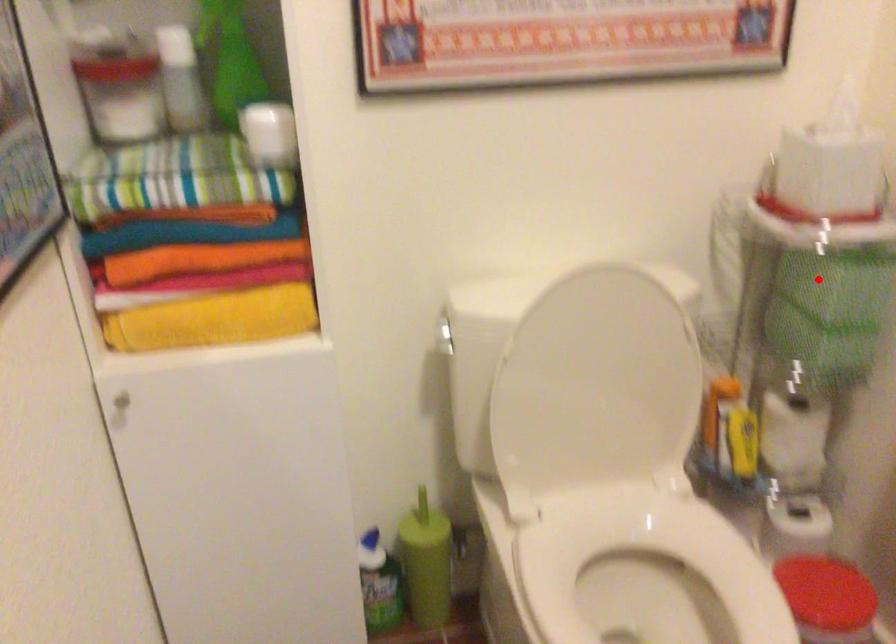
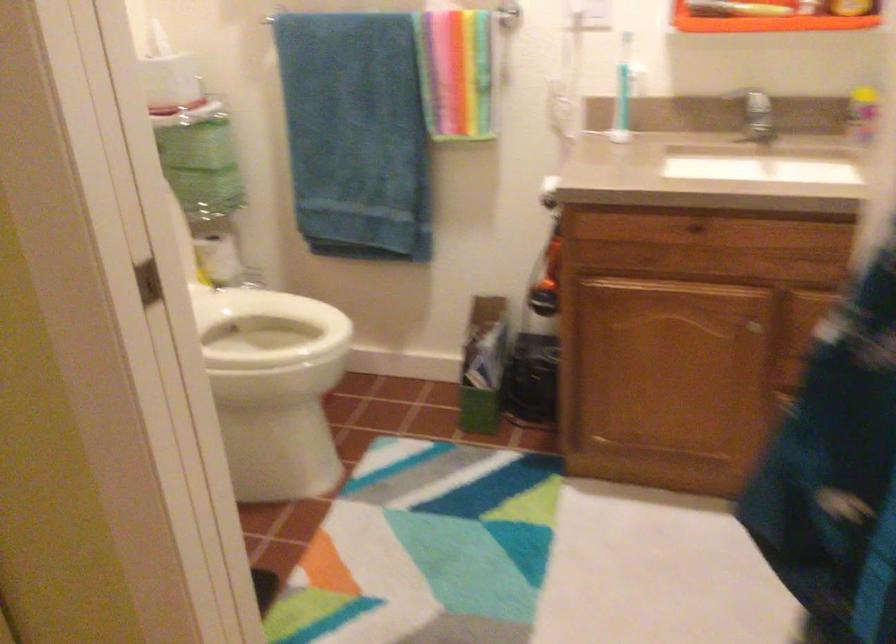
Question: I am providing you with two images of the same scene from different viewpoints. Image1 has a red point marked. In image2, the corresponding 3D location appears at what relative position? Reply with the corresponding letter.

Choices:
 (A) Closer
 (B) Farther

Answer: (B)